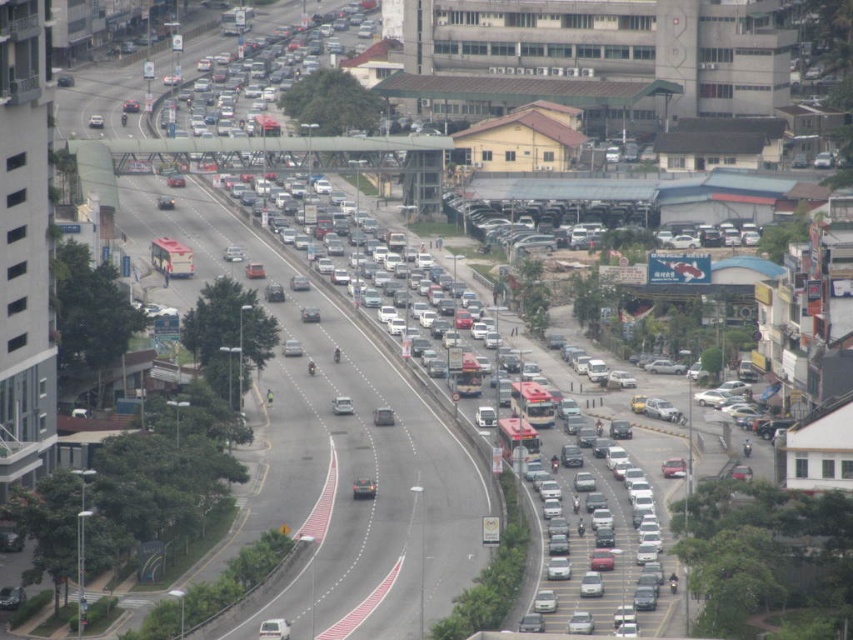
Measure the distance between point (200, 275) and camera.

They are 251.69 meters apart.

Is metallic gray highway at center closer to the viewer compared to matte silver car at center?

Yes.

Who is more forward, (68, 100) or (355, 486)?

Point (355, 486) is in front.

What are the coordinates of `metallic gray highway at center` in the screenshot? It's located at 334,442.

Identify the location of metallic gray highway at center. The image size is (853, 640). (x=334, y=442).

This screenshot has width=853, height=640. Find the location of `metallic gray highway at center`. metallic gray highway at center is located at coordinates (334, 442).

Does matte silver car at center appear on the left side of silver metallic car at center?

In fact, matte silver car at center is to the right of silver metallic car at center.

Can you confirm if matte silver car at center is positioned above silver metallic car at center?

No.

Find the location of a particular element. This screenshot has height=640, width=853. matte silver car at center is located at coordinates (363, 488).